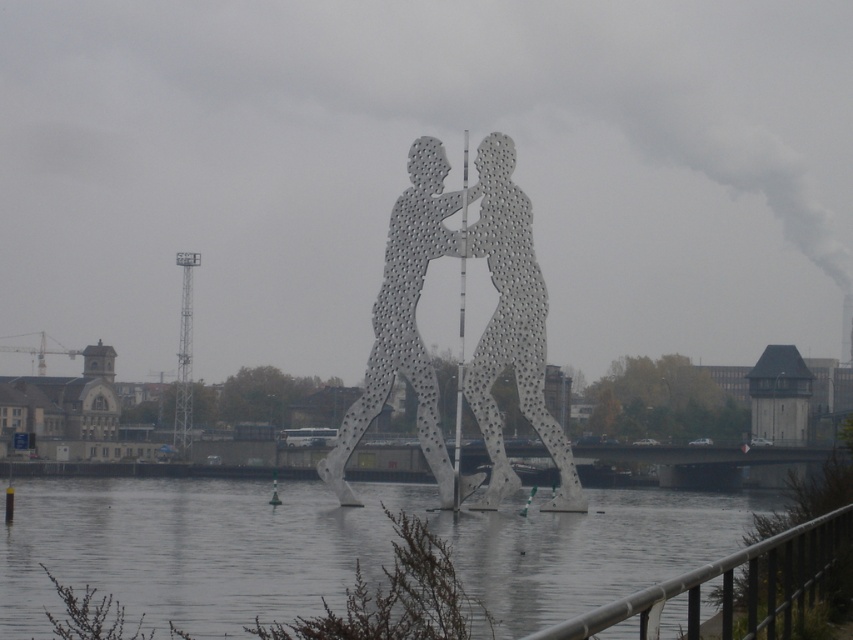
Does gray metallic water at center appear on the left side of metallic pole at center?

In fact, gray metallic water at center is to the right of metallic pole at center.

Can you confirm if gray metallic water at center is positioned below metallic pole at center?

Yes.

This screenshot has height=640, width=853. I want to click on gray metallic water at center, so click(x=190, y=547).

The height and width of the screenshot is (640, 853). What do you see at coordinates (190, 547) in the screenshot? I see `gray metallic water at center` at bounding box center [190, 547].

Locate an element on the screen. gray metallic water at center is located at coordinates (190, 547).

Is metallic perforated figures at center wider than metallic pole at center?

Indeed, metallic perforated figures at center has a greater width compared to metallic pole at center.

Between metallic perforated figures at center and metallic pole at center, which one has more height?

With more height is metallic pole at center.

Describe the element at coordinates (480, 337) in the screenshot. I see `metallic perforated figures at center` at that location.

I want to click on metallic perforated figures at center, so click(x=480, y=337).